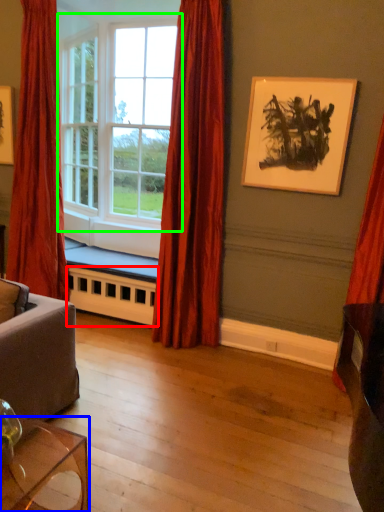
Question: Which object is positioned closest to radiator (highlighted by a red box)? Select from table (highlighted by a blue box) and window (highlighted by a green box).

Choices:
 (A) table
 (B) window

Answer: (B)